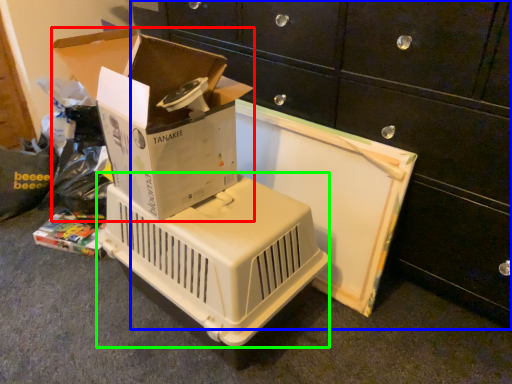
Question: Which object is positioned closest to box (highlighted by a red box)? Select from furniture (highlighted by a blue box) and appliance (highlighted by a green box).

Choices:
 (A) furniture
 (B) appliance

Answer: (B)